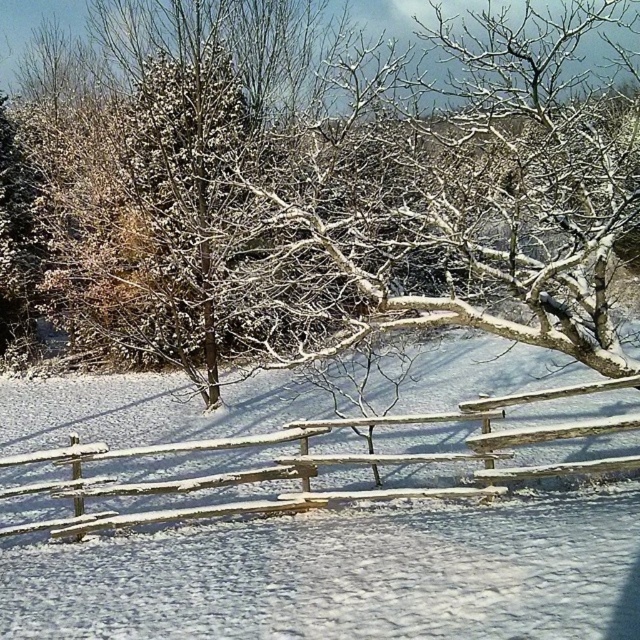
Which is behind, point (573, 218) or point (442, 420)?

The point (442, 420) is behind.

Image resolution: width=640 pixels, height=640 pixels. In order to click on snow-covered branches at center in this screenshot , I will do pyautogui.click(x=333, y=180).